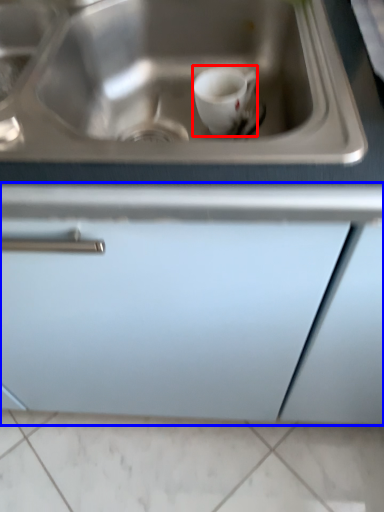
Question: Which point is closer to the camera, coffee cup (highlighted by a red box) or cabinetry (highlighted by a blue box)?

Choices:
 (A) coffee cup
 (B) cabinetry

Answer: (B)